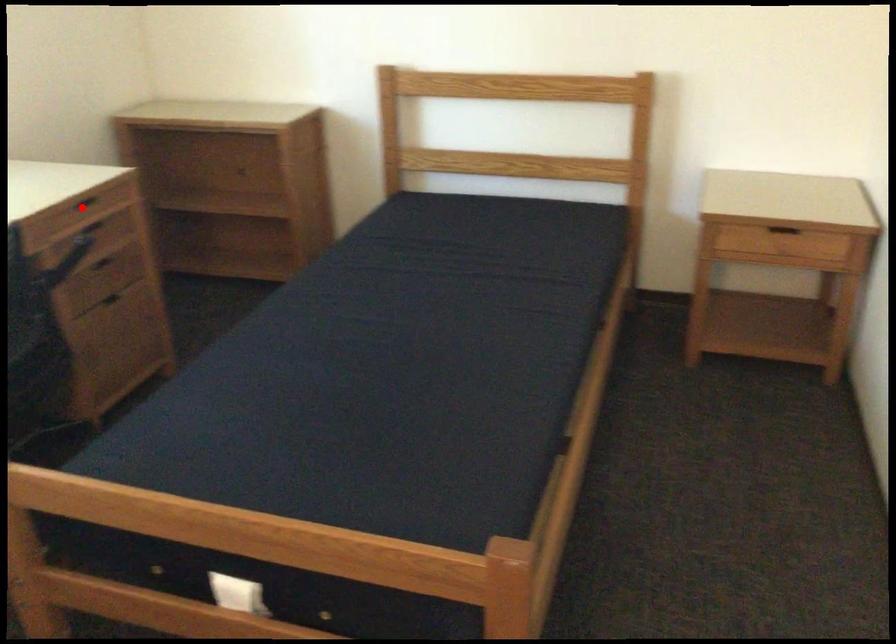
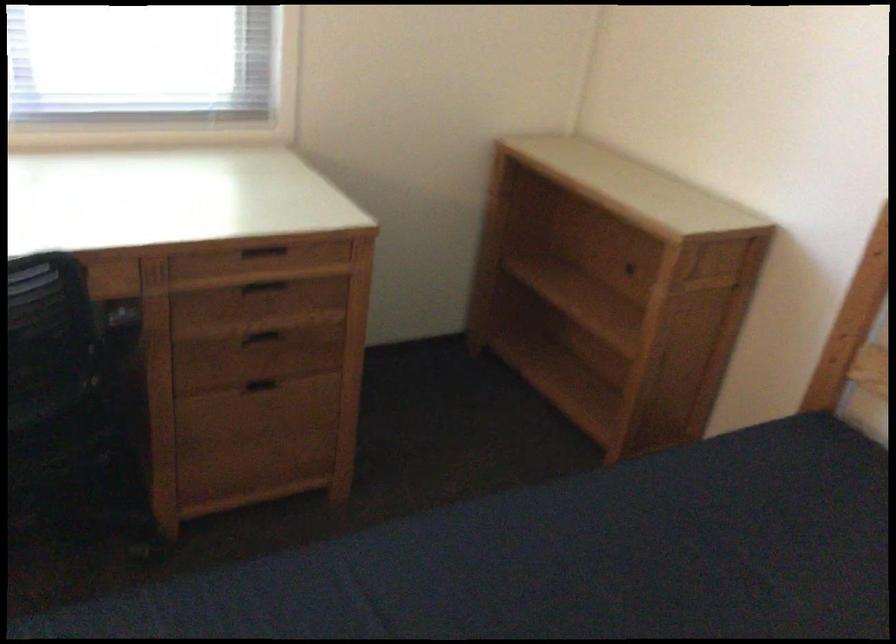
Question: I am providing you with two images of the same scene from different viewpoints. Image1 has a red point marked. In image2, the corresponding 3D location appears at what relative position? Reply with the corresponding letter.

Choices:
 (A) Closer
 (B) Farther

Answer: (A)